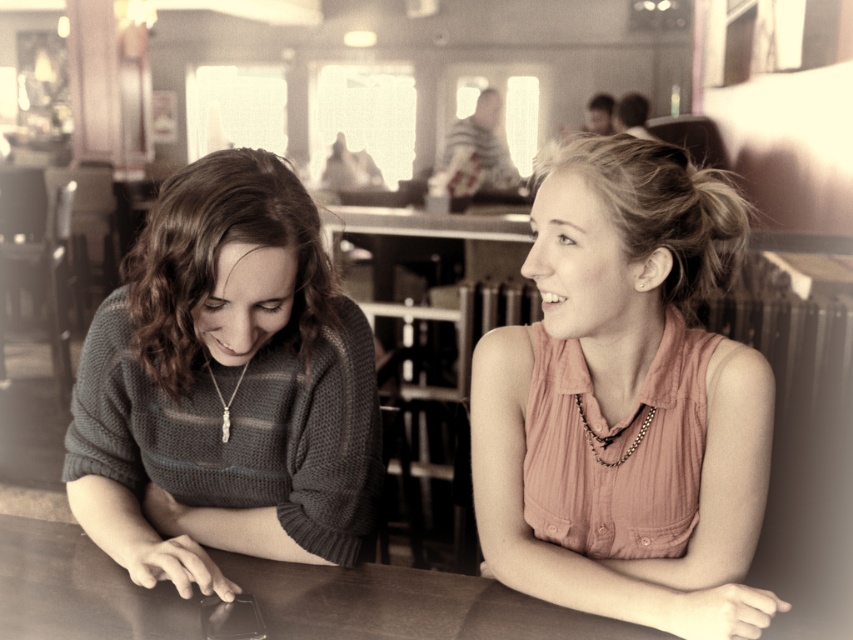
You are a photographer trying to capture a candid shot of the person wearing the pink fabric shirt at upper right. Since you can only take the photo from behind the brown wooden table at center, will the table block your view of the shirt?

The pink fabric shirt at upper right is in front of the brown wooden table at center, so the table will not block your view of the shirt.

You are a photographer trying to capture a candid shot of both the knitted sweater at left and the gold chain necklace at center. Since you can only focus on one subject at a time, which one should you choose to ensure both are in the frame?

You should focus on the knitted sweater at left because it is positioned to the left of the gold chain necklace at center, so keeping the knitted sweater at left in focus will naturally include the gold chain necklace at center within the frame.

You are a photographer trying to capture a candid shot of both the knitted sweater at left and the gold chain necklace at lower center in the same frame. Based on their positions, which object should you focus on first to ensure both are in the shot?

The knitted sweater at left is to the right of the gold chain necklace at lower center, so you should focus on the gold chain necklace at lower center first to ensure both are in the frame.